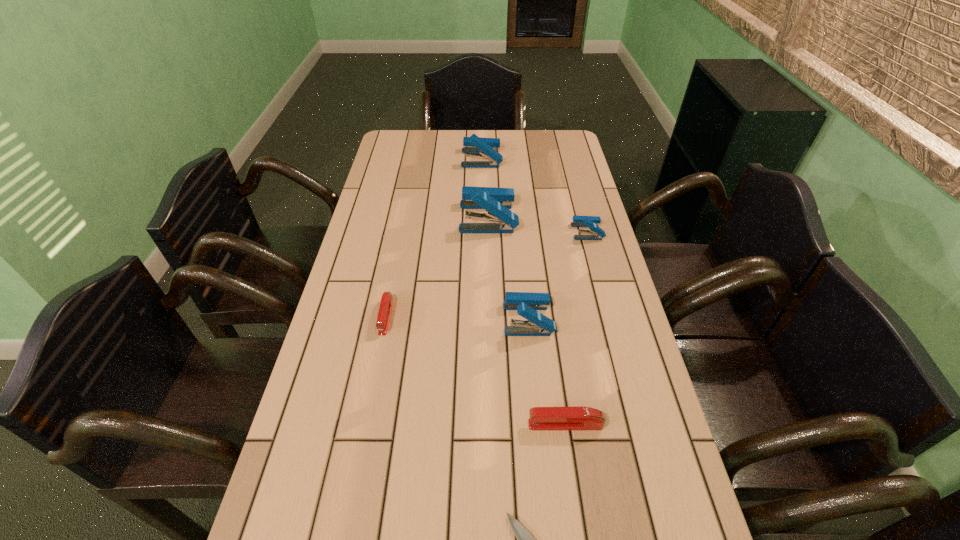
At what (x,y) coordinates should I click in order to perform the action: click on the shortest stapler. Please return your answer as a coordinate pair (x, y). Looking at the image, I should click on (385, 307).

Where is `the farther red stapler`? Image resolution: width=960 pixels, height=540 pixels. the farther red stapler is located at coordinates (385, 307).

Where is `free space located on the front of the tallest object`? The width and height of the screenshot is (960, 540). free space located on the front of the tallest object is located at coordinates (490, 276).

Image resolution: width=960 pixels, height=540 pixels. I want to click on free region located on the front of the sixth shortest object, so click(482, 233).

Identify the location of vacant space located 0.130m on the back of the nearest blue stapler. point(523,267).

This screenshot has width=960, height=540. Find the location of `vacant area located on the back of the rightmost stapler`. vacant area located on the back of the rightmost stapler is located at coordinates (575, 187).

The image size is (960, 540). In order to click on vacant space located on the front-facing side of the sixth farthest object in this screenshot , I will do `click(494, 424)`.

The width and height of the screenshot is (960, 540). In order to click on free region located 0.160m on the front-facing side of the sixth farthest object in this screenshot , I will do `click(450, 424)`.

Identify the location of vacant space situated on the front-facing side of the sixth farthest object. (381, 424).

Locate an element on the screen. Image resolution: width=960 pixels, height=540 pixels. free space located 0.110m on the front-facing side of the left red stapler is located at coordinates (374, 375).